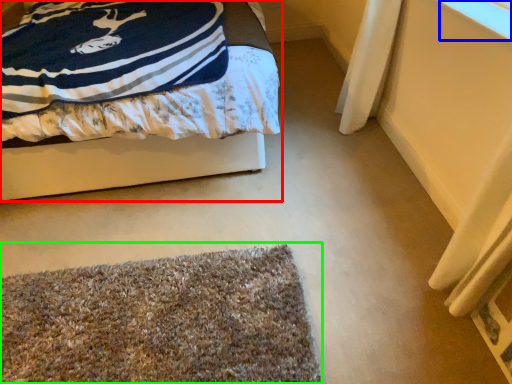
Question: Which object is positioned farthest from bed (highlighted by a red box)? Select from window screen (highlighted by a blue box) and mat (highlighted by a green box).

Choices:
 (A) window screen
 (B) mat

Answer: (A)